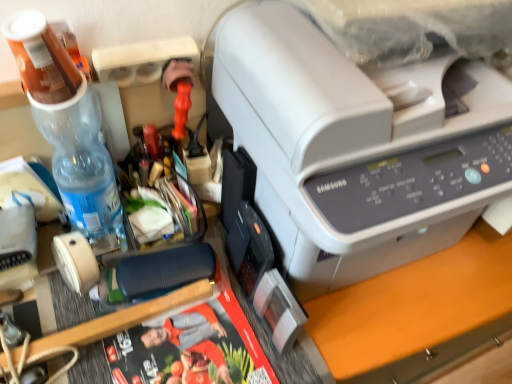
Question: From a real-world perspective, is beige matte tape at lower left over white plastic printer at upper right?

Choices:
 (A) no
 (B) yes

Answer: (A)

Question: Is beige matte tape at lower left wider than white plastic printer at upper right?

Choices:
 (A) no
 (B) yes

Answer: (A)

Question: Is beige matte tape at lower left further to camera compared to white plastic printer at upper right?

Choices:
 (A) yes
 (B) no

Answer: (A)

Question: Is beige matte tape at lower left shorter than white plastic printer at upper right?

Choices:
 (A) no
 (B) yes

Answer: (B)

Question: Is white plastic printer at upper right surrounded by beige matte tape at lower left?

Choices:
 (A) no
 (B) yes

Answer: (A)

Question: From a real-world perspective, is beige matte tape at lower left below white plastic printer at upper right?

Choices:
 (A) no
 (B) yes

Answer: (B)

Question: Considering the relative sizes of matte black magazine at center and translucent plastic bottle at upper left in the image provided, is matte black magazine at center wider than translucent plastic bottle at upper left?

Choices:
 (A) yes
 (B) no

Answer: (A)

Question: From the image's perspective, does matte black magazine at center appear higher than translucent plastic bottle at upper left?

Choices:
 (A) no
 (B) yes

Answer: (A)

Question: Is matte black magazine at center at the left side of translucent plastic bottle at upper left?

Choices:
 (A) no
 (B) yes

Answer: (A)

Question: Would you say matte black magazine at center is outside translucent plastic bottle at upper left?

Choices:
 (A) no
 (B) yes

Answer: (B)

Question: Is matte black magazine at center far away from translucent plastic bottle at upper left?

Choices:
 (A) no
 (B) yes

Answer: (A)

Question: From the image's perspective, is matte black magazine at center located beneath translucent plastic bottle at upper left?

Choices:
 (A) no
 (B) yes

Answer: (B)

Question: From the image's perspective, does translucent plastic bottle at upper left appear higher than matte black magazine at center?

Choices:
 (A) no
 (B) yes

Answer: (B)